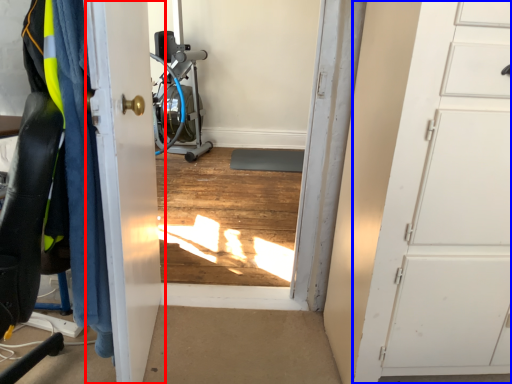
Question: Which of the following is the closest to the observer, door (highlighted by a red box) or door (highlighted by a blue box)?

Choices:
 (A) door
 (B) door

Answer: (A)